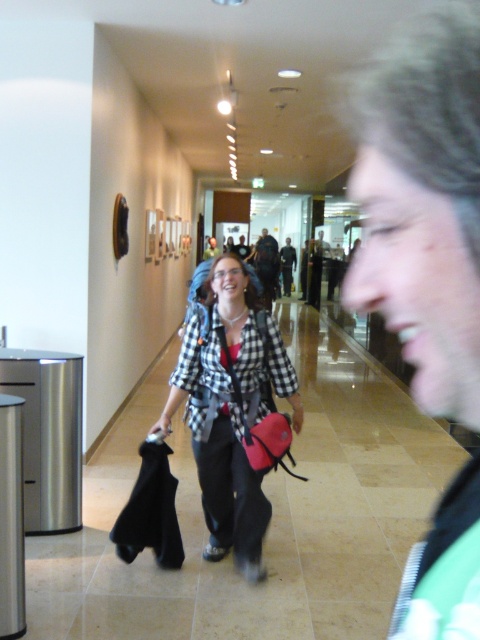
Question: Which object is closer to the camera taking this photo?

Choices:
 (A) matte red bag at center
 (B) checkered fabric shirt at center
 (C) dark brown leather jacket at center
 (D) green fabric jacket at right

Answer: (D)

Question: Which point is farther to the camera?

Choices:
 (A) dark brown leather jacket at center
 (B) dark blue jeans at center
 (C) matte red bag at center

Answer: (B)

Question: Does matte red bag at center have a smaller size compared to dark blue jeans at center?

Choices:
 (A) yes
 (B) no

Answer: (A)

Question: Where is checkered fabric shirt at center located in relation to matte red bag at center in the image?

Choices:
 (A) left
 (B) right

Answer: (A)

Question: Which object is farther from the camera taking this photo?

Choices:
 (A) dark blue jeans at center
 (B) matte red bag at center
 (C) checkered fabric shirt at center

Answer: (A)

Question: Can you confirm if green fabric jacket at right is wider than dark blue jeans at center?

Choices:
 (A) no
 (B) yes

Answer: (A)